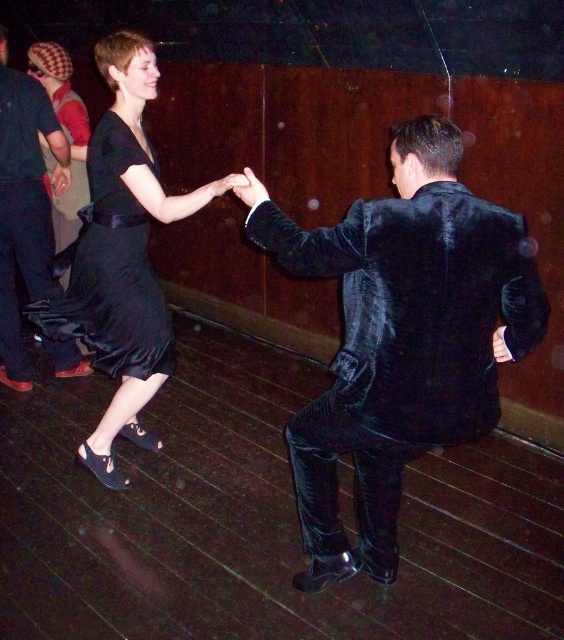
Can you confirm if velvet black suit at right is shorter than satin black dress at center?

In fact, velvet black suit at right may be taller than satin black dress at center.

Does point (350, 268) lie in front of point (111, 236)?

Yes, point (350, 268) is in front of point (111, 236).

Is point (394, 164) in front of point (138, 298)?

Yes.

Where is `velvet black suit at right`? The image size is (564, 640). velvet black suit at right is located at coordinates (402, 337).

Is the position of black satin dress at upper left less distant than that of satin black dress at center?

That is True.

Which is more to the right, black satin dress at upper left or satin black dress at center?

black satin dress at upper left is more to the right.

Who is more forward, (135, 381) or (125, 198)?

Point (125, 198)

I want to click on black satin dress at upper left, so click(x=122, y=253).

Is point (144, 317) positioned before point (25, 228)?

Yes.

Find the location of `satin black dress at center`. satin black dress at center is located at coordinates (113, 269).

Is point (130, 273) closer to camera compared to point (19, 220)?

Yes, it is in front of point (19, 220).

Where is `satin black dress at center`? The height and width of the screenshot is (640, 564). satin black dress at center is located at coordinates (113, 269).